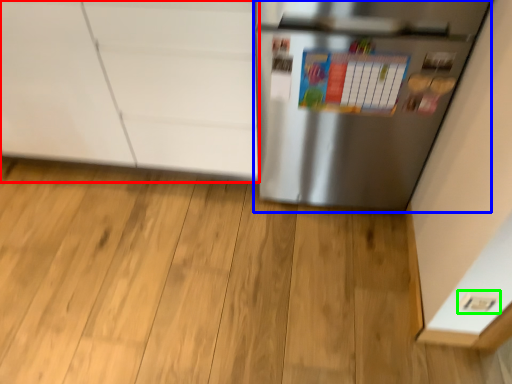
Question: Estimate the real-world distances between objects in this image. Which object is farther from cabinetry (highlighted by a red box), refrigerator (highlighted by a blue box) or electric outlet (highlighted by a green box)?

Choices:
 (A) refrigerator
 (B) electric outlet

Answer: (B)